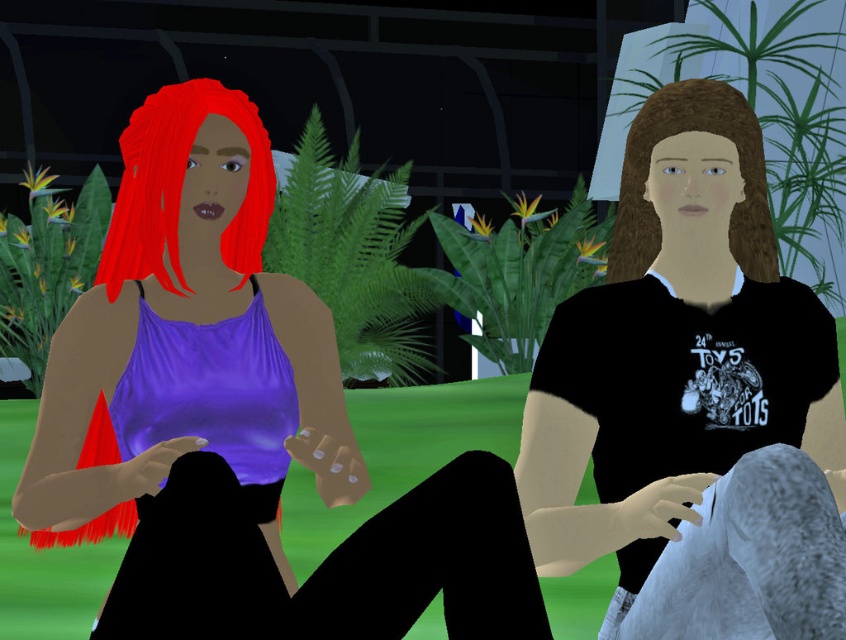
Question: Is satin purple tank top at left to the right of matte black t-shirt at right from the viewer's perspective?

Choices:
 (A) no
 (B) yes

Answer: (A)

Question: Does shiny red hair at left appear on the left side of brown matte hair at center?

Choices:
 (A) yes
 (B) no

Answer: (A)

Question: Which is nearer to the shiny red hair at left?

Choices:
 (A) satin purple tank top at left
 (B) matte black t-shirt at right
 (C) brown matte hair at center

Answer: (A)

Question: Which object is positioned farthest from the brown matte hair at center?

Choices:
 (A) satin purple tank top at left
 (B) matte black t-shirt at right
 (C) shiny red hair at left

Answer: (A)

Question: Which point appears farthest from the camera in this image?

Choices:
 (A) (669, 308)
 (B) (130, 129)
 (C) (737, 129)
 (D) (223, 276)

Answer: (D)

Question: Is matte black t-shirt at right to the right of brown matte hair at center from the viewer's perspective?

Choices:
 (A) no
 (B) yes

Answer: (B)